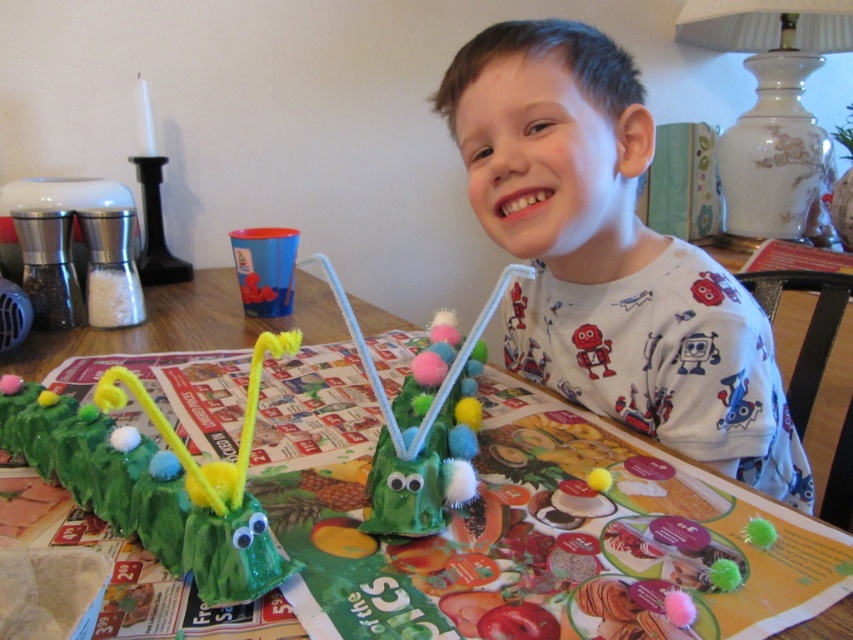
Question: Is green felt caterpillar at lower left to the left of green paper table at center from the viewer's perspective?

Choices:
 (A) yes
 (B) no

Answer: (B)

Question: Which point is closer to the camera taking this photo?

Choices:
 (A) (595, 147)
 (B) (242, 316)

Answer: (A)

Question: Which of these objects is positioned farthest from the green felt caterpillar at lower left?

Choices:
 (A) white cotton shirt at upper center
 (B) green fuzzy caterpillar at center

Answer: (A)

Question: Estimate the real-world distances between objects in this image. Which object is farther from the white cotton shirt at upper center?

Choices:
 (A) green felt caterpillar at lower left
 (B) green paper table at center
 (C) green fuzzy caterpillar at center

Answer: (A)

Question: Observing the image, what is the correct spatial positioning of green felt caterpillar at lower left in reference to green fuzzy caterpillar at center?

Choices:
 (A) right
 (B) left

Answer: (B)

Question: Is white cotton shirt at upper center thinner than green felt caterpillar at lower left?

Choices:
 (A) yes
 (B) no

Answer: (B)